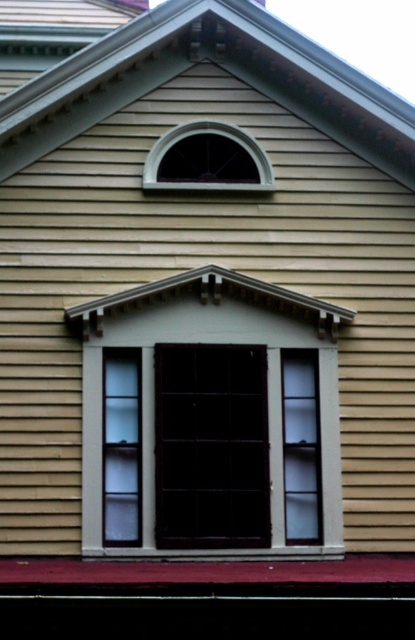
The width and height of the screenshot is (415, 640). What are the coordinates of `matte gray window at center` in the screenshot? It's located at [209, 420].

Is point (322, 417) more distant than point (215, 173)?

That is False.

Locate an element on the screen. matte gray window at center is located at coordinates (209, 420).